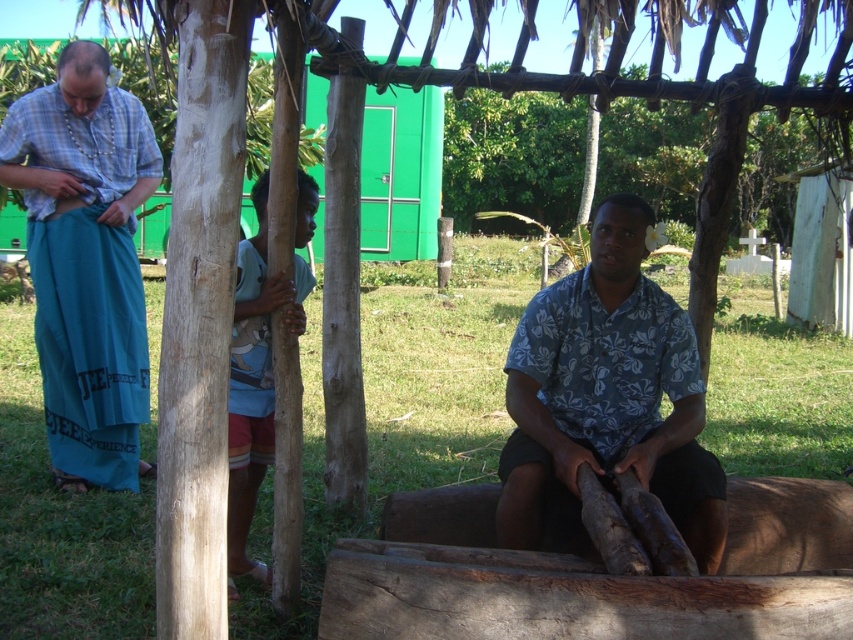
You are observing a cultural activity under a wooden shelter. There is a man wearing a floral print shirt at center and another person with light blue fabric at center. Which clothing item is shorter?

The floral print shirt at center is shorter than the light blue fabric at center.

You are standing at the origin point in the scene. Which object is located at coordinates point (x=86, y=260)?

The point (x=86, y=260) corresponds to the teal fabric sarong at left.

You are a visitor at this outdoor event and want to take a photo of the floral print shirt at center and the teal fabric sarong at left. Which one should you focus on first to ensure both are in the frame?

You should focus on the floral print shirt at center first since it is closer to the viewer than the teal fabric sarong at left, ensuring both are in the frame.